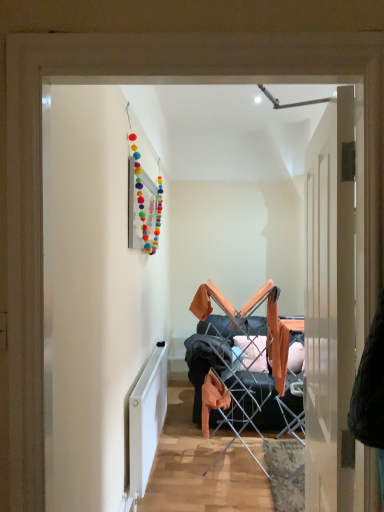
This screenshot has height=512, width=384. What do you see at coordinates (147, 419) in the screenshot?
I see `white matte radiator at lower left` at bounding box center [147, 419].

Locate an element on the screen. This screenshot has width=384, height=512. white matte radiator at lower left is located at coordinates (x=147, y=419).

At what (x,y) coordinates should I click in order to perform the action: click on wooden door at right. Please return your answer as a coordinate pair (x, y). Looking at the image, I should click on (330, 307).

Consider the image. In order to face wooden door at right, should I rotate leftwards or rightwards?

You should look right and rotate roughly 16.894 degrees.

Image resolution: width=384 pixels, height=512 pixels. Describe the element at coordinates (330, 307) in the screenshot. I see `wooden door at right` at that location.

Where is `white matte radiator at lower left`? white matte radiator at lower left is located at coordinates (147, 419).

Considering the relative positions of wooden door at right and white matte radiator at lower left in the image provided, is wooden door at right to the left of white matte radiator at lower left from the viewer's perspective?

In fact, wooden door at right is to the right of white matte radiator at lower left.

Which object is further away from the camera taking this photo, wooden door at right or white matte radiator at lower left?

Positioned behind is white matte radiator at lower left.

Does point (325, 454) appear closer or farther from the camera than point (150, 417)?

Point (325, 454) is positioned closer to the camera compared to point (150, 417).

From the image's perspective, which is below, wooden door at right or white matte radiator at lower left?

white matte radiator at lower left is shown below in the image.

From a real-world perspective, is wooden door at right beneath white matte radiator at lower left?

Actually, wooden door at right is physically above white matte radiator at lower left in the real world.

Is wooden door at right wider than white matte radiator at lower left?

Correct, the width of wooden door at right exceeds that of white matte radiator at lower left.

Between wooden door at right and white matte radiator at lower left, which one has less height?

white matte radiator at lower left.

Who is bigger, wooden door at right or white matte radiator at lower left?

Bigger between the two is wooden door at right.

Would you say wooden door at right is inside or outside white matte radiator at lower left?

wooden door at right exists outside the volume of white matte radiator at lower left.

Is wooden door at right not near white matte radiator at lower left?

That's right, there is a large distance between wooden door at right and white matte radiator at lower left.

Could you tell me if wooden door at right is turned towards white matte radiator at lower left?

No, wooden door at right is not turned towards white matte radiator at lower left.

What's the angular difference between wooden door at right and white matte radiator at lower left's facing directions?

The facing directions of wooden door at right and white matte radiator at lower left are 174 degrees apart.

Locate an element on the screen. The width and height of the screenshot is (384, 512). door that is above the white matte radiator at lower left (from a real-world perspective) is located at coordinates (330, 307).

Which is more to the left, white matte radiator at lower left or wooden door at right?

white matte radiator at lower left.

Which is in front, white matte radiator at lower left or wooden door at right?

wooden door at right is closer to the camera.

Which is behind, point (149, 404) or point (319, 380)?

Point (149, 404)

From the image's perspective, which is below, white matte radiator at lower left or wooden door at right?

white matte radiator at lower left.

From a real-world perspective, is white matte radiator at lower left above or below wooden door at right?

Clearly, from a real-world perspective, white matte radiator at lower left is below wooden door at right.

Based on the photo, considering the relative sizes of white matte radiator at lower left and wooden door at right in the image provided, is white matte radiator at lower left wider than wooden door at right?

No, white matte radiator at lower left is not wider than wooden door at right.

In terms of height, does white matte radiator at lower left look taller or shorter compared to wooden door at right?

In the image, white matte radiator at lower left appears to be shorter than wooden door at right.

Is white matte radiator at lower left bigger or smaller than wooden door at right?

white matte radiator at lower left is smaller than wooden door at right.

Based on the photo, choose the correct answer: Is white matte radiator at lower left inside wooden door at right or outside it?

white matte radiator at lower left is located beyond the bounds of wooden door at right.

Is white matte radiator at lower left next to wooden door at right?

No, white matte radiator at lower left is not with wooden door at right.

Is white matte radiator at lower left turned away from wooden door at right?

white matte radiator at lower left does not have its back to wooden door at right.

How different are the orientations of white matte radiator at lower left and wooden door at right in degrees?

174 degrees separate the facing orientations of white matte radiator at lower left and wooden door at right.

Where is `radiator lying behind the wooden door at right`? Image resolution: width=384 pixels, height=512 pixels. radiator lying behind the wooden door at right is located at coordinates (147, 419).

The height and width of the screenshot is (512, 384). I want to click on door on the right of white matte radiator at lower left, so click(x=330, y=307).

Locate an element on the screen. door located in front of the white matte radiator at lower left is located at coordinates (330, 307).